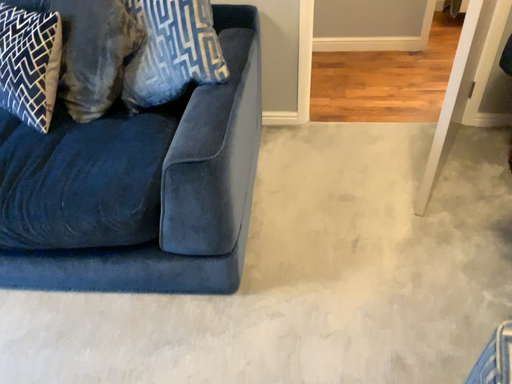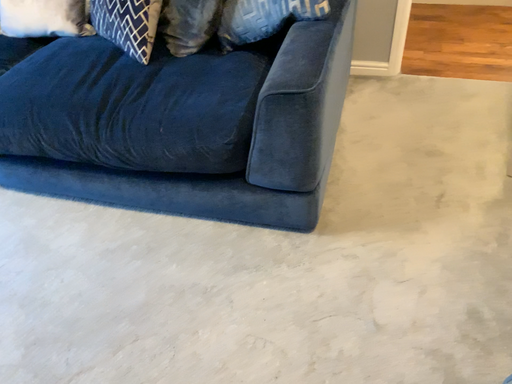
Question: How did the camera likely rotate when shooting the video?

Choices:
 (A) rotated left
 (B) rotated right

Answer: (A)